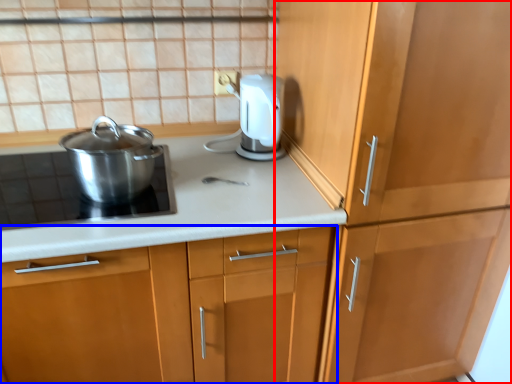
Question: Which of the following is the closest to the observer, cabinetry (highlighted by a red box) or cabinetry (highlighted by a blue box)?

Choices:
 (A) cabinetry
 (B) cabinetry

Answer: (A)